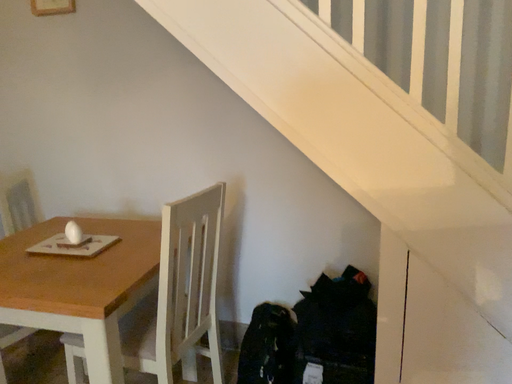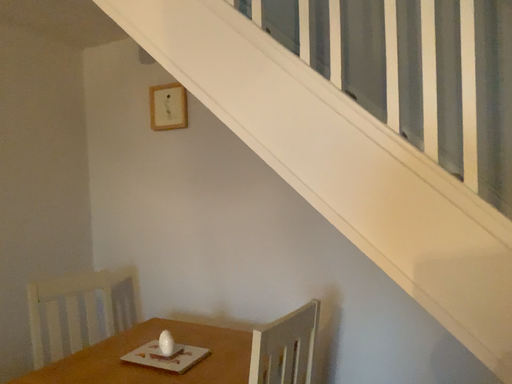
Question: How did the camera likely rotate when shooting the video?

Choices:
 (A) rotated right
 (B) rotated left

Answer: (B)